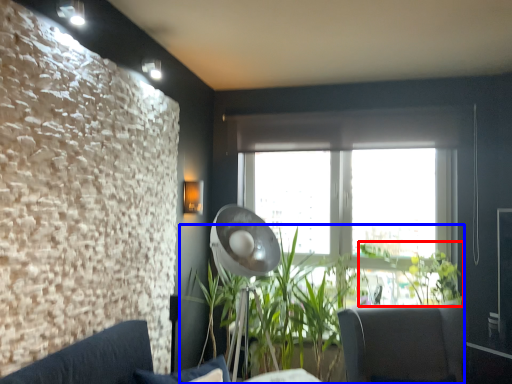
Question: Which point is closer to the camera, plant (highlighted by a red box) or houseplant (highlighted by a blue box)?

Choices:
 (A) plant
 (B) houseplant

Answer: (B)